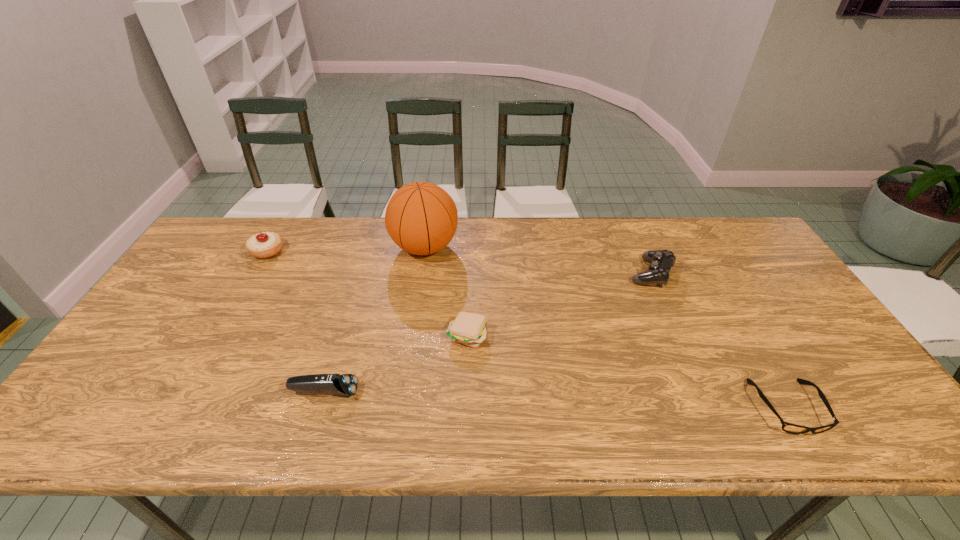
Where is `basketball`? The image size is (960, 540). basketball is located at coordinates (421, 218).

I want to click on the second tallest object, so click(x=263, y=245).

Identify the location of pastry. (263, 245).

Where is `the fifth object from left to right`? the fifth object from left to right is located at coordinates (661, 261).

The height and width of the screenshot is (540, 960). Find the location of `electric shaver`. electric shaver is located at coordinates (346, 384).

I want to click on patty, so [x=470, y=329].

Locate an element on the screen. This screenshot has width=960, height=540. the rightmost object is located at coordinates (787, 427).

You are a GUI agent. You are given a task and a screenshot of the screen. Output one action in this format:
    pyautogui.click(x=<x>, y=<y>)
    Task: Click on the spectacles
    This screenshot has width=960, height=540.
    Given the screenshot: What is the action you would take?
    pyautogui.click(x=787, y=427)

Where is `vacant space positioned on the right of the basketball`? vacant space positioned on the right of the basketball is located at coordinates (564, 247).

What are the coordinates of `free space located 0.060m on the front of the leftmost object` in the screenshot? It's located at (254, 274).